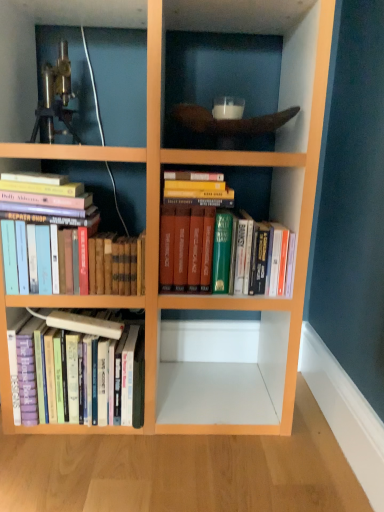
The image size is (384, 512). I want to click on vacant area situated below hardcover books at left, the 2th book positioned from the right (from a real-world perspective), so click(x=73, y=315).